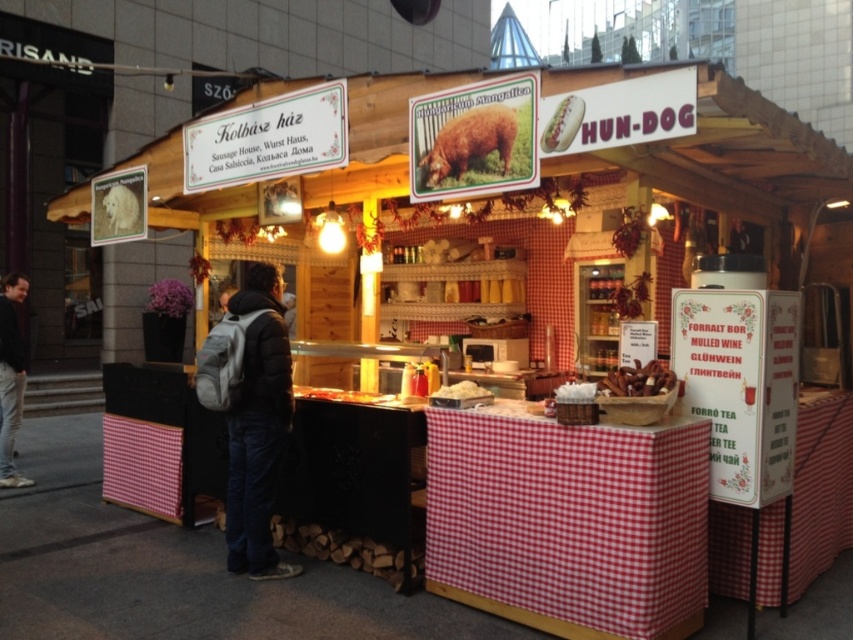
Question: Which is nearer to the dark gray sweater at left?

Choices:
 (A) golden brown bread at center
 (B) brown furry dog at center
 (C) dark blue jeans at center
 (D) white bread at upper center

Answer: (A)

Question: Is brown furry dog at center positioned in front of white fluffy bread at center?

Choices:
 (A) no
 (B) yes

Answer: (B)

Question: Among these objects, which one is nearest to the camera?

Choices:
 (A) dark blue jeans at center
 (B) dark gray sweater at left
 (C) white bread at upper center

Answer: (C)

Question: Does white bread at upper center have a lesser width compared to white fluffy bread at center?

Choices:
 (A) yes
 (B) no

Answer: (A)

Question: Can you confirm if golden brown bread at center is wider than white fluffy bread at center?

Choices:
 (A) yes
 (B) no

Answer: (A)

Question: Among these points, which one is nearest to the camera?

Choices:
 (A) (566, 97)
 (B) (485, 394)

Answer: (A)